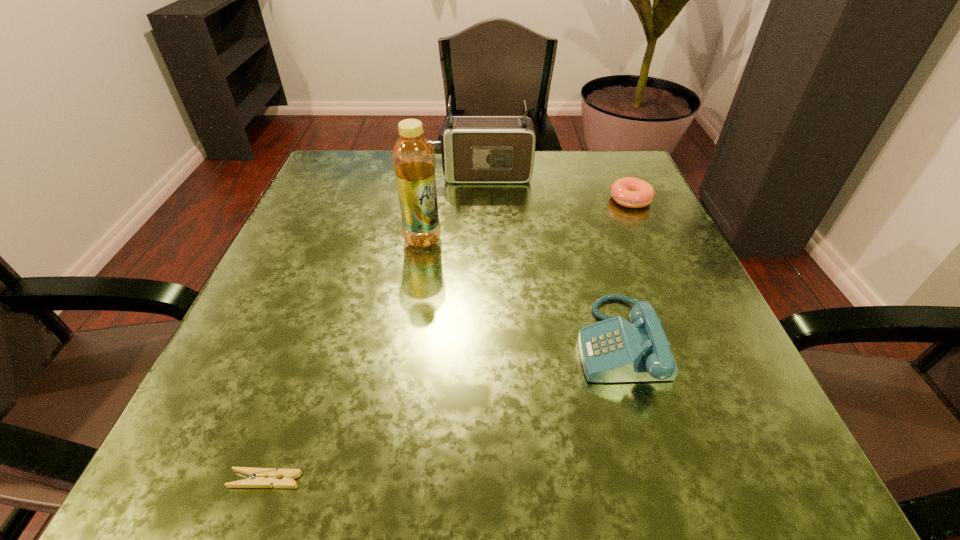
In order to click on unoccupied position between the doughnut and the third tallest object in this screenshot , I will do `click(624, 271)`.

The height and width of the screenshot is (540, 960). What are the coordinates of `free spot between the farthest object and the fourth object from left to right` in the screenshot? It's located at (549, 259).

Find the location of `vacant region between the bottle and the fourth nearest object`. vacant region between the bottle and the fourth nearest object is located at coordinates (527, 220).

Where is `free space that is in between the second farthest object and the second tallest object`? Image resolution: width=960 pixels, height=540 pixels. free space that is in between the second farthest object and the second tallest object is located at coordinates (556, 187).

This screenshot has height=540, width=960. I want to click on object that ranks as the third closest to the third farthest object, so click(630, 192).

I want to click on object that is the third closest one to the second farthest object, so click(414, 163).

Find the location of a particular element. vacant space that satisfies the following two spatial constraints: 1. on the back side of the doughnut; 2. at the lens of the fourth shortest object is located at coordinates (619, 176).

The height and width of the screenshot is (540, 960). What are the coordinates of `vacant space that satisfies the following two spatial constraints: 1. on the back side of the clothespin; 2. on the right side of the doughnut` in the screenshot? It's located at click(363, 200).

Where is `vacant space that satisfies the following two spatial constraints: 1. on the back side of the fourth tallest object; 2. at the lens of the second tallest object`? The width and height of the screenshot is (960, 540). vacant space that satisfies the following two spatial constraints: 1. on the back side of the fourth tallest object; 2. at the lens of the second tallest object is located at coordinates (619, 176).